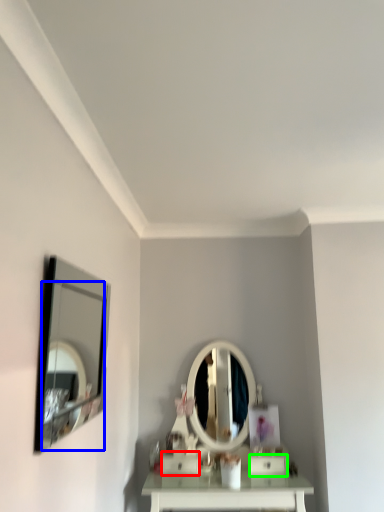
Question: Based on their relative distances, which object is nearer to drawer (highlighted by a red box)? Choose from mirror (highlighted by a blue box) and drawer (highlighted by a green box).

Choices:
 (A) mirror
 (B) drawer

Answer: (B)